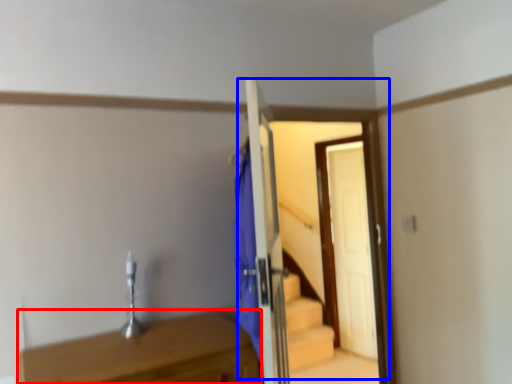
Question: Among these objects, which one is nearest to the camera, table (highlighted by a red box) or door (highlighted by a blue box)?

Choices:
 (A) table
 (B) door

Answer: (A)